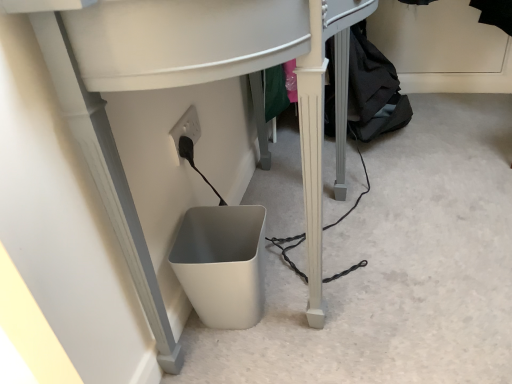
Image resolution: width=512 pixels, height=384 pixels. Describe the element at coordinates (222, 263) in the screenshot. I see `white matte waste container at lower center` at that location.

Where is `white plastic computer desk at lower center`? The image size is (512, 384). white plastic computer desk at lower center is located at coordinates (220, 65).

The image size is (512, 384). What do you see at coordinates (374, 89) in the screenshot?
I see `black fabric at lower right` at bounding box center [374, 89].

Locate an element on the screen. The height and width of the screenshot is (384, 512). white matte waste container at lower center is located at coordinates (222, 263).

Considering the sizes of white matte waste container at lower center and white plastic computer desk at lower center in the image, is white matte waste container at lower center taller or shorter than white plastic computer desk at lower center?

Considering their sizes, white matte waste container at lower center has less height than white plastic computer desk at lower center.

Considering the positions of objects white matte waste container at lower center and white plastic computer desk at lower center in the image provided, who is in front, white matte waste container at lower center or white plastic computer desk at lower center?

Positioned in front is white plastic computer desk at lower center.

Would you say white matte waste container at lower center is outside white plastic computer desk at lower center?

No, white matte waste container at lower center is not outside of white plastic computer desk at lower center.

Locate an element on the screen. computer desk that is on the left side of black fabric at lower right is located at coordinates (220, 65).

Can you confirm if black fabric at lower right is taller than white plastic computer desk at lower center?

Incorrect, the height of black fabric at lower right is not larger of that of white plastic computer desk at lower center.

Does black fabric at lower right lie in front of white plastic computer desk at lower center?

No, black fabric at lower right is behind white plastic computer desk at lower center.

Which object is positioned more to the left, black fabric at lower right or white plastic computer desk at lower center?

From the viewer's perspective, white plastic computer desk at lower center appears more on the left side.

Considering the relative sizes of white matte waste container at lower center and black fabric at lower right in the image provided, is white matte waste container at lower center wider than black fabric at lower right?

In fact, white matte waste container at lower center might be narrower than black fabric at lower right.

From a real-world perspective, is white matte waste container at lower center above or below black fabric at lower right?

white matte waste container at lower center is situated lower than black fabric at lower right in the real world.

Is white matte waste container at lower center in front of or behind black fabric at lower right in the image?

In the image, white matte waste container at lower center appears in front of black fabric at lower right.

Are white plastic computer desk at lower center and white matte waste container at lower center making contact?

No, white plastic computer desk at lower center is not next to white matte waste container at lower center.

Considering the sizes of objects white plastic computer desk at lower center and white matte waste container at lower center in the image provided, who is thinner, white plastic computer desk at lower center or white matte waste container at lower center?

Thinner between the two is white matte waste container at lower center.

Where is `computer desk above the white matte waste container at lower center (from a real-world perspective)`? This screenshot has width=512, height=384. computer desk above the white matte waste container at lower center (from a real-world perspective) is located at coordinates (220, 65).

Is white matte waste container at lower center completely or partially inside white plastic computer desk at lower center?

Yes, white matte waste container at lower center is inside white plastic computer desk at lower center.

Are white plastic computer desk at lower center and black fabric at lower right far apart?

No, white plastic computer desk at lower center is not far from black fabric at lower right.

From the image's perspective, is white plastic computer desk at lower center located beneath black fabric at lower right?

Indeed, from the image's perspective, white plastic computer desk at lower center is shown beneath black fabric at lower right.

Find the location of `computer desk located above the black fabric at lower right (from a real-world perspective)`. computer desk located above the black fabric at lower right (from a real-world perspective) is located at coordinates (220, 65).

From the image's perspective, between black fabric at lower right and white matte waste container at lower center, who is located below?

white matte waste container at lower center appears lower in the image.

From a real-world perspective, is black fabric at lower right above or below white matte waste container at lower center?

In terms of real-world spatial position, black fabric at lower right is above white matte waste container at lower center.

Looking at this image, which point is more distant from viewer, (374, 109) or (223, 234)?

The point (374, 109) is more distant.

This screenshot has height=384, width=512. What are the coordinates of `waste container lying behind the white plastic computer desk at lower center` in the screenshot? It's located at (222, 263).

The width and height of the screenshot is (512, 384). Find the location of `clothing above the white plastic computer desk at lower center (from the image's perspective)`. clothing above the white plastic computer desk at lower center (from the image's perspective) is located at coordinates (374, 89).

Considering their positions, is black fabric at lower right positioned further to white matte waste container at lower center than white plastic computer desk at lower center?

Among the two, black fabric at lower right is located further to white matte waste container at lower center.

Considering their positions, is white plastic computer desk at lower center positioned further to white matte waste container at lower center than black fabric at lower right?

Based on the image, black fabric at lower right appears to be further to white matte waste container at lower center.

Considering their positions, is black fabric at lower right positioned closer to white plastic computer desk at lower center than white matte waste container at lower center?

The object closer to white plastic computer desk at lower center is white matte waste container at lower center.

Considering their positions, is white matte waste container at lower center positioned closer to white plastic computer desk at lower center than black fabric at lower right?

white matte waste container at lower center is positioned closer to the anchor white plastic computer desk at lower center.

In the scene shown: When comparing their distances from black fabric at lower right, does white plastic computer desk at lower center or white matte waste container at lower center seem further?

The object further to black fabric at lower right is white plastic computer desk at lower center.

When comparing their distances from black fabric at lower right, does white matte waste container at lower center or white plastic computer desk at lower center seem closer?

white matte waste container at lower center is positioned closer to the anchor black fabric at lower right.

Find the location of a particular element. This screenshot has height=384, width=512. waste container between white plastic computer desk at lower center and black fabric at lower right along the z-axis is located at coordinates (222, 263).